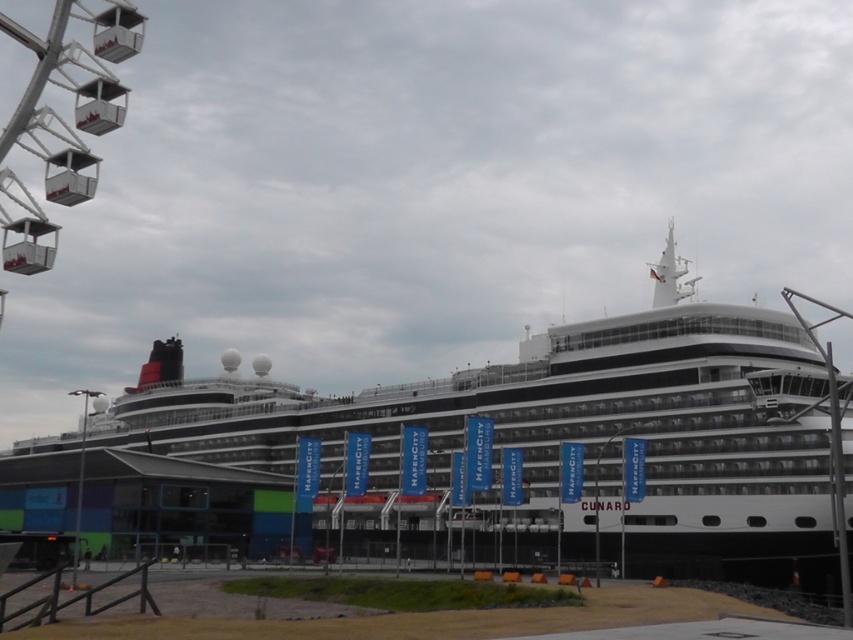
Who is shorter, white glossy cruise ship at center or metallic silver ferris wheel at upper left?

Standing shorter between the two is white glossy cruise ship at center.

Does white glossy cruise ship at center appear on the right side of metallic silver ferris wheel at upper left?

Indeed, white glossy cruise ship at center is positioned on the right side of metallic silver ferris wheel at upper left.

Which is behind, point (157, 426) or point (80, 49)?

Positioned behind is point (157, 426).

Locate an element on the screen. The image size is (853, 640). white glossy cruise ship at center is located at coordinates (543, 444).